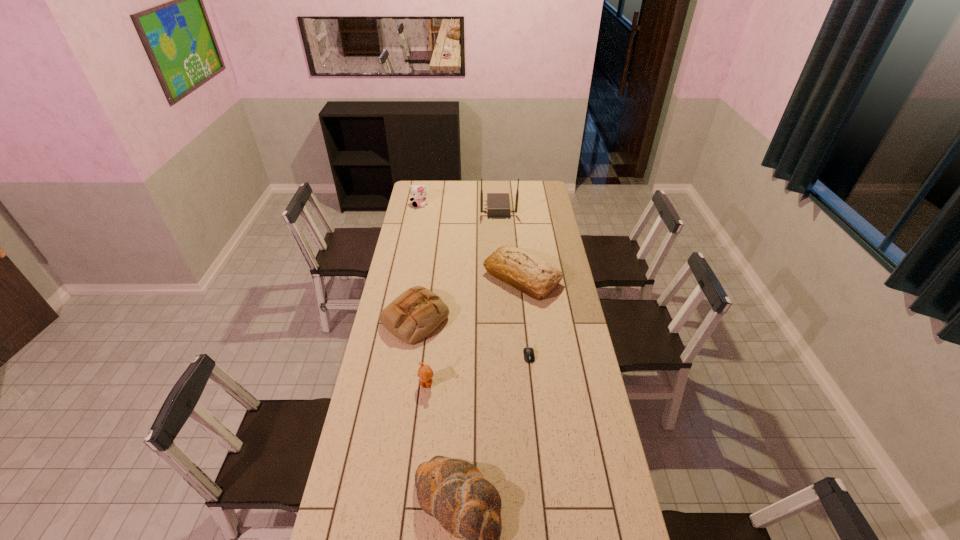
Locate an element on the screen. This screenshot has width=960, height=540. vacant region located on the right of the shortest object is located at coordinates (573, 356).

At what (x,y) coordinates should I click in order to perform the action: click on object that is at the far edge. Please return your answer as a coordinate pair (x, y). Looking at the image, I should click on (498, 204).

Where is `kitten present at the left edge`? Image resolution: width=960 pixels, height=540 pixels. kitten present at the left edge is located at coordinates (418, 192).

Find the location of a particular element. bread at the left edge is located at coordinates (417, 312).

Locate an element on the screen. object that is at the right edge is located at coordinates (522, 270).

Where is `vacant space at the far edge of the desktop`? This screenshot has height=540, width=960. vacant space at the far edge of the desktop is located at coordinates point(450,187).

This screenshot has width=960, height=540. In the image, there is a desktop. Find the location of `vacant space at the left edge`. vacant space at the left edge is located at coordinates (336, 534).

This screenshot has width=960, height=540. I want to click on vacant space at the right edge of the desktop, so click(540, 250).

Find the location of `object that is the fifth closest to the kitten`. object that is the fifth closest to the kitten is located at coordinates (425, 373).

This screenshot has height=540, width=960. What are the coordinates of `object that ranks as the third closest to the tallest object` in the screenshot? It's located at (417, 312).